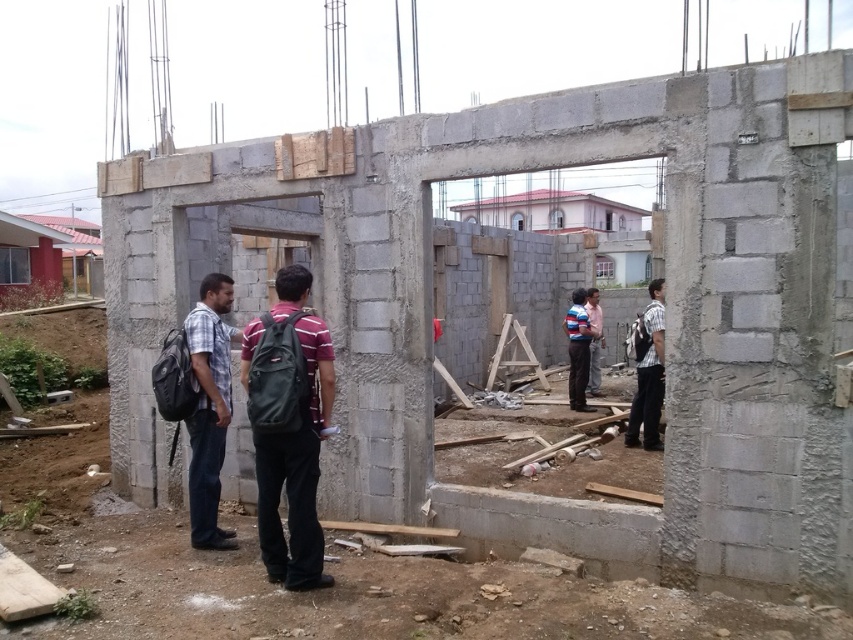
Question: Is dark gray backpack at center smaller than striped shirt at right?

Choices:
 (A) yes
 (B) no

Answer: (A)

Question: Considering the relative positions of gray concrete foundation at lower center and striped shirt at center in the image provided, where is gray concrete foundation at lower center located with respect to striped shirt at center?

Choices:
 (A) below
 (B) above

Answer: (A)

Question: Is plaid shirt at center smaller than striped shirt at right?

Choices:
 (A) yes
 (B) no

Answer: (A)

Question: Which object is closer to the camera taking this photo?

Choices:
 (A) gray concrete foundation at lower center
 (B) dark gray backpack at center
 (C) striped shirt at right

Answer: (B)

Question: Which is nearer to the striped shirt at center?

Choices:
 (A) plaid shirt at center
 (B) striped shirt at right
 (C) gray concrete foundation at lower center

Answer: (B)

Question: Which point is closer to the camera?

Choices:
 (A) (196, 310)
 (B) (589, 305)
 (C) (485, 552)

Answer: (C)